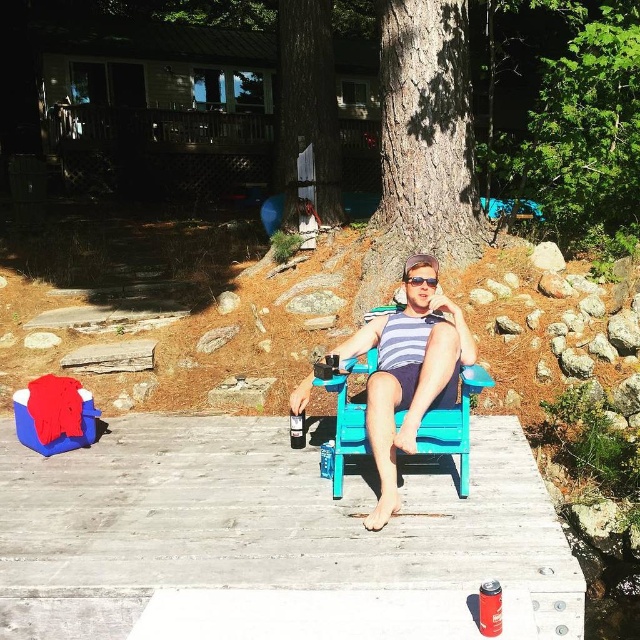
You are standing on the wooden dock at center and want to reach the metallic can at center to grab a drink. Which direction should you move to get to the can?

The wooden dock at center is to the left of the metallic can at center, so you should move to the right to reach the metallic can at center.

You are standing on the wooden dock and want to sit down. There is a blue wood chair at center and a smooth bark tree at center. Which object is closer to your right side?

The blue wood chair at center is to the right of the smooth bark tree at center, so the blue wood chair at center is closer to your right side.

You are standing at the edge of the lake and want to reach the wooden dock at center to retrieve your sunglasses that fell off. Which direction should you move towards relative to the dock?

The wooden dock at center is located at point [273,518], so you should move towards the coordinates provided to reach it.